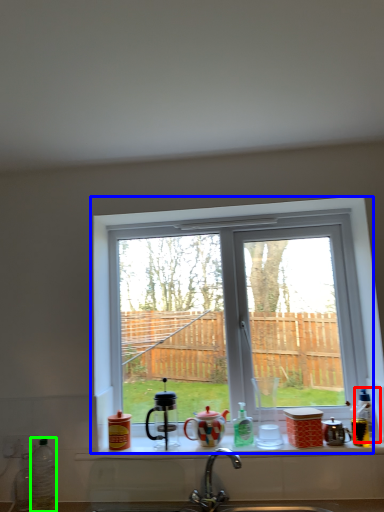
Question: Which is farther away from bottle (highlighted by a red box)? window (highlighted by a blue box) or bottle (highlighted by a green box)?

Choices:
 (A) window
 (B) bottle

Answer: (B)